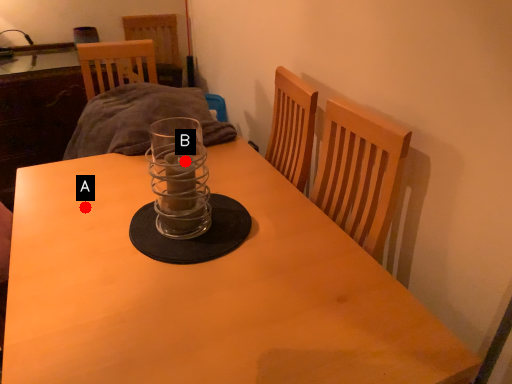
Question: Two points are circled on the image, labeled by A and B beside each circle. Which point is closer to the camera?

Choices:
 (A) A is closer
 (B) B is closer

Answer: (B)